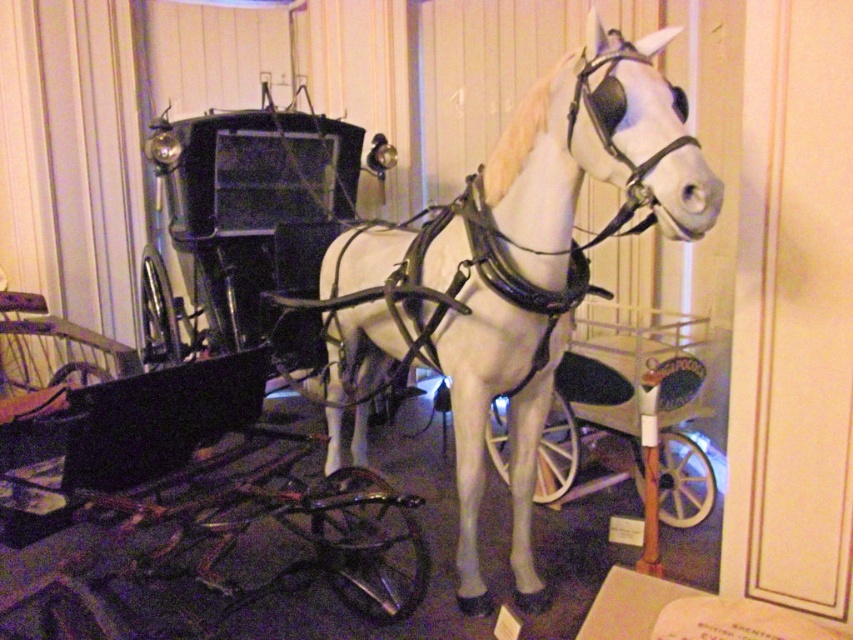
From the picture: You are a museum guide explaining the exhibit to visitors. You need to inform them about the relative sizes of the white glossy horse at center and the metallic silver cart at center. What do you tell them?

The white glossy horse at center is larger in size than the metallic silver cart at center.

You are a tour guide explaining the exhibit to visitors. You need to describe the arrangement of the white glossy horse at center and the metallic silver cart at center. Which one is located to the left of the other?

The white glossy horse at center is positioned on the left side of the metallic silver cart at center.

You are a tour guide explaining the exhibit to visitors. You want to mention the distance between the white glossy horse at center and the metallic silver cart at center. What do you tell them?

The white glossy horse at center and the metallic silver cart at center are 84.06 centimeters apart from each other.